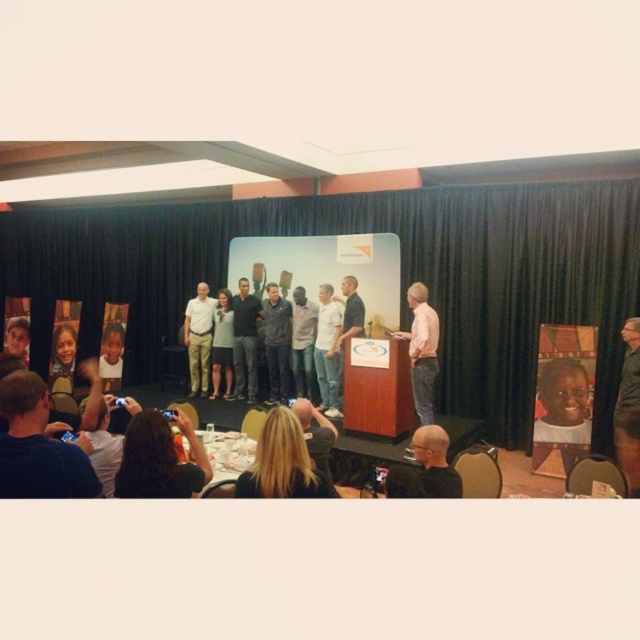
Question: Among these objects, which one is nearest to the camera?

Choices:
 (A) pink shirt at center
 (B) white shirt at center

Answer: (A)

Question: Can you confirm if black fabric curtain at center is positioned to the right of white shirt at center?

Choices:
 (A) yes
 (B) no

Answer: (B)

Question: Which object appears farthest from the camera in this image?

Choices:
 (A) black fabric curtain at center
 (B) dark gray jacket at center

Answer: (B)

Question: Which of the following is the closest to the observer?

Choices:
 (A) dark gray jacket at center
 (B) denim jeans at center
 (C) dark brown leather jacket at lower left

Answer: (C)

Question: Is dark gray jacket at center further to camera compared to dark gray shirt at center?

Choices:
 (A) yes
 (B) no

Answer: (A)

Question: Does pink shirt at center have a greater width compared to light brown hair at center?

Choices:
 (A) yes
 (B) no

Answer: (A)